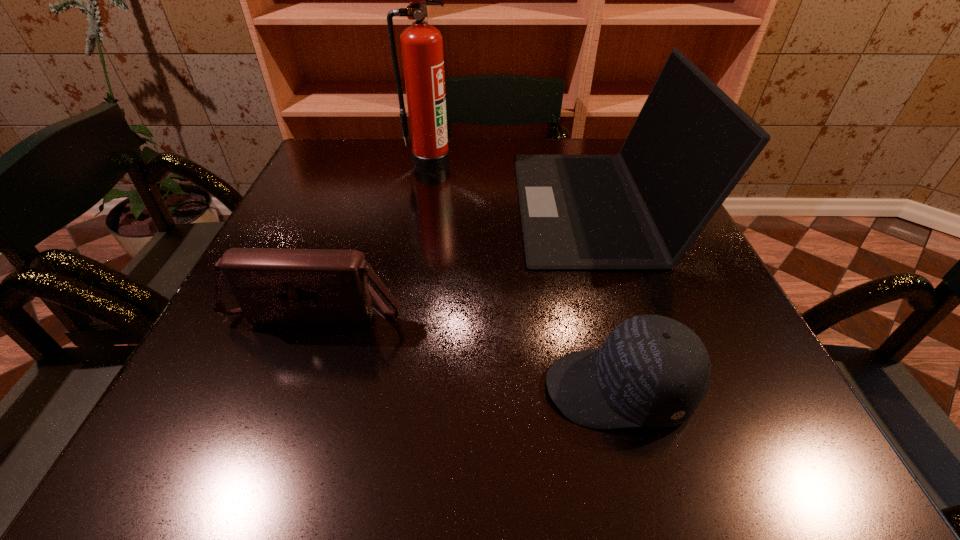
Find the location of a particular element. The image size is (960, 540). fire extinguisher is located at coordinates (421, 43).

Where is `the second tallest object`? the second tallest object is located at coordinates (643, 208).

Identify the location of the second nearest object. This screenshot has height=540, width=960. click(x=290, y=287).

What are the coordinates of `the third tallest object` in the screenshot? It's located at coord(290,287).

At what (x,y) coordinates should I click in order to perform the action: click on baseball cap. Please return your answer as a coordinate pair (x, y). This screenshot has height=540, width=960. Looking at the image, I should click on (652, 371).

Locate an element on the screen. The width and height of the screenshot is (960, 540). the nearest object is located at coordinates (652, 371).

The width and height of the screenshot is (960, 540). What are the coordinates of `free space located with the nozzle pointing from the back of the tallest object` in the screenshot? It's located at (417, 242).

You are a GUI agent. You are given a task and a screenshot of the screen. Output one action in this format:
    pyautogui.click(x=<x>, y=<y>)
    Task: Click on the vacant space located on the screen of the third shortest object
    This screenshot has width=960, height=540.
    Given the screenshot: What is the action you would take?
    pyautogui.click(x=400, y=205)

Where is `vacant space located on the screen of the third shortest object`? The width and height of the screenshot is (960, 540). vacant space located on the screen of the third shortest object is located at coordinates (387, 205).

What are the coordinates of `vacant region located 0.250m on the screen of the third shortest object` in the screenshot? It's located at (409, 205).